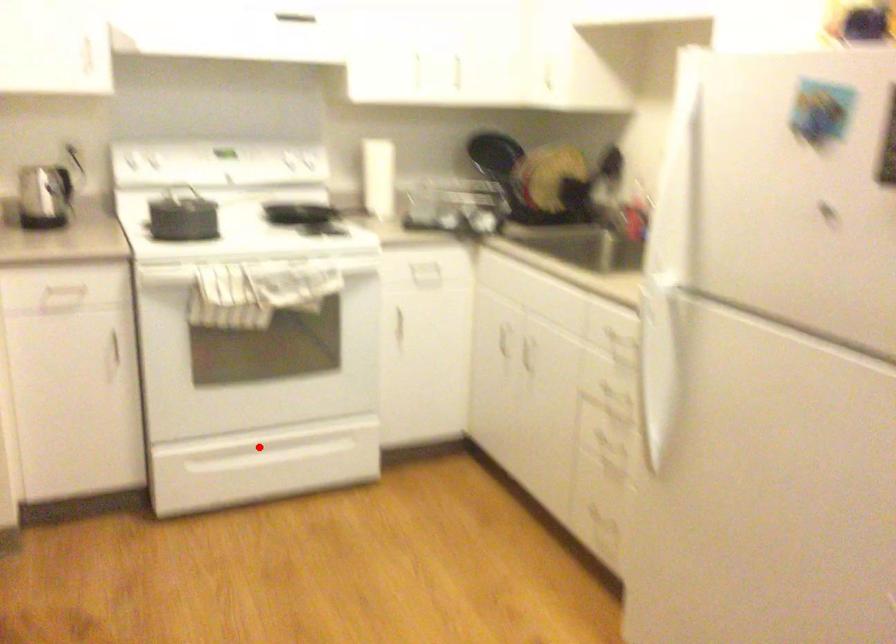
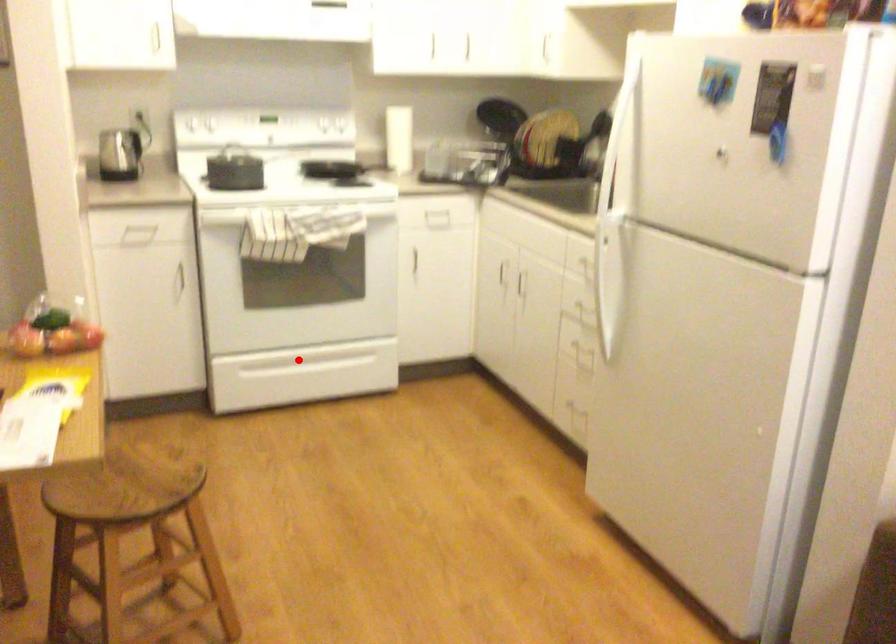
I am providing you with two images of the same scene from different viewpoints. A red point is marked on the first image and another point is marked on the second image. Are the points marked in image1 and image2 representing the same 3D position?

Yes